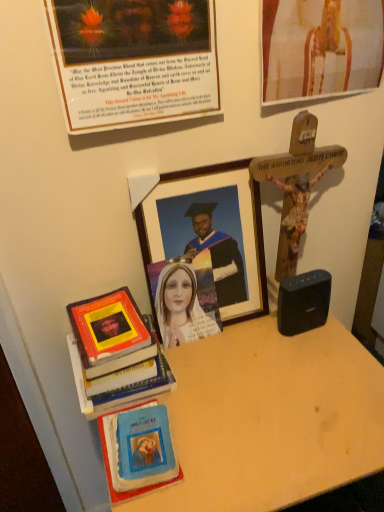
In order to click on free point to the right of blue matte book at center, positioned as the second book in top-to-bottom order in this screenshot , I will do `click(230, 438)`.